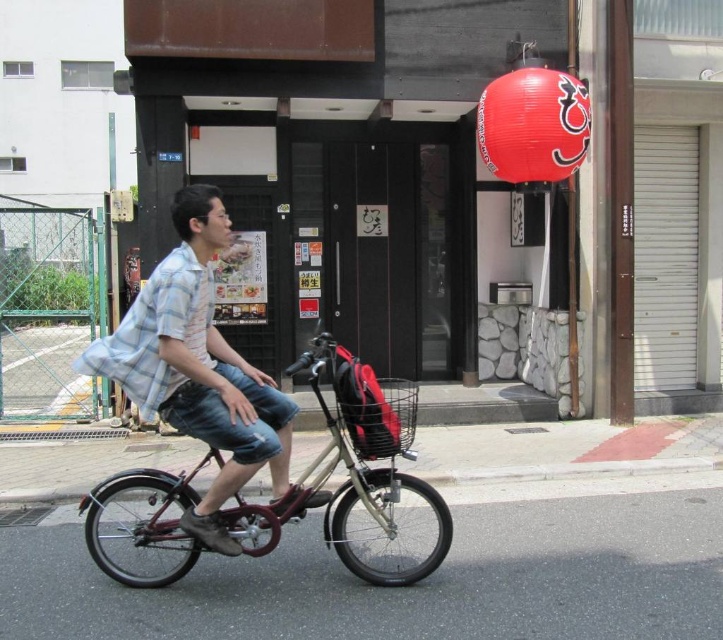
You are a delivery person who needs to park your metallic maroon bicycle at center near the shiny red paper lantern at upper center. Considering the space available, can you safely park the bicycle without touching the lantern?

The metallic maroon bicycle at center might be wider than the shiny red paper lantern at upper center, so there is a possibility that parking the bicycle could cause it to touch the lantern. You should check the width of the bicycle and the distance between them to ensure safe parking.

You are a photographer standing in front of the building. You want to take a photo of the shiny red paper lantern at upper center and the light blue plaid shirt at center. Which object should you focus on first if you want to capture both in the same frame without moving the camera?

You should focus on the shiny red paper lantern at upper center first because it is higher up in the frame compared to the light blue plaid shirt at center, allowing both to be captured in the same shot without moving the camera.

You are a photographer trying to capture the light blue plaid shirt at center and the metallic maroon bicycle at center in a single shot. Since the shirt is in front of the bicycle, will you need to adjust your camera angle to ensure both are fully visible in the frame?

Yes, since the light blue plaid shirt at center is in front of the metallic maroon bicycle at center, you will need to adjust your camera angle to ensure both are fully visible in the frame.